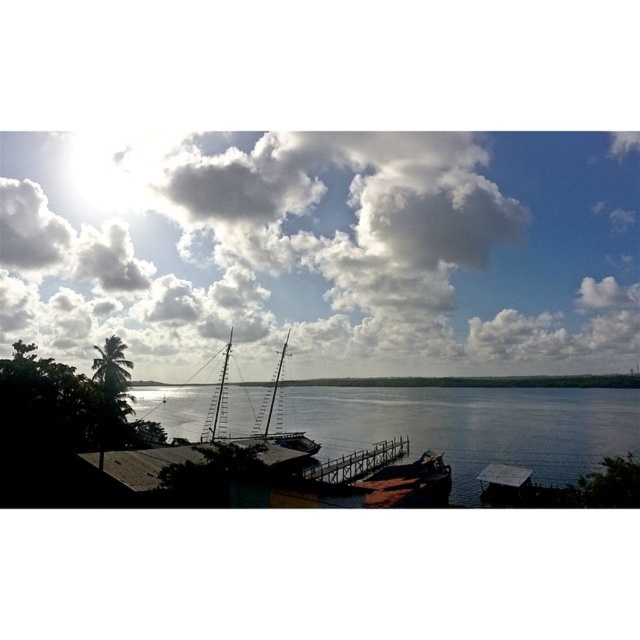
You are a photographer planning to take a photo of the wooden dock at center and the white fluffy cloud at upper center. Based on the scene, which object will appear closer to the camera in the photo?

The white fluffy cloud at upper center will appear closer to the camera in the photo because the wooden dock at center is behind it.

You are a photographer planning to capture the entire wooden dock at center in one shot. Considering the white fluffy cloud at upper center, could the cloud potentially block the view of the dock in your photo?

The white fluffy cloud at upper center might be wider than the wooden dock at center, so there is a possibility that the cloud could block part of the dock in the photo.

You are standing on the wooden dock at center and looking up at the sky. Which direction should you turn to see the white fluffy cloud at upper center?

You should turn to your left because the white fluffy cloud at upper center is located to the left of the wooden dock at center, which means it is in the upper left direction from your position on the dock.